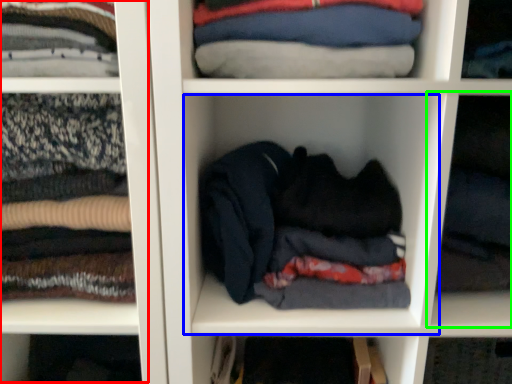
Question: Which object is the closest to the cabinet (highlighted by a red box)? Choose among these: cabinet (highlighted by a blue box) or cabinet (highlighted by a green box).

Choices:
 (A) cabinet
 (B) cabinet

Answer: (A)